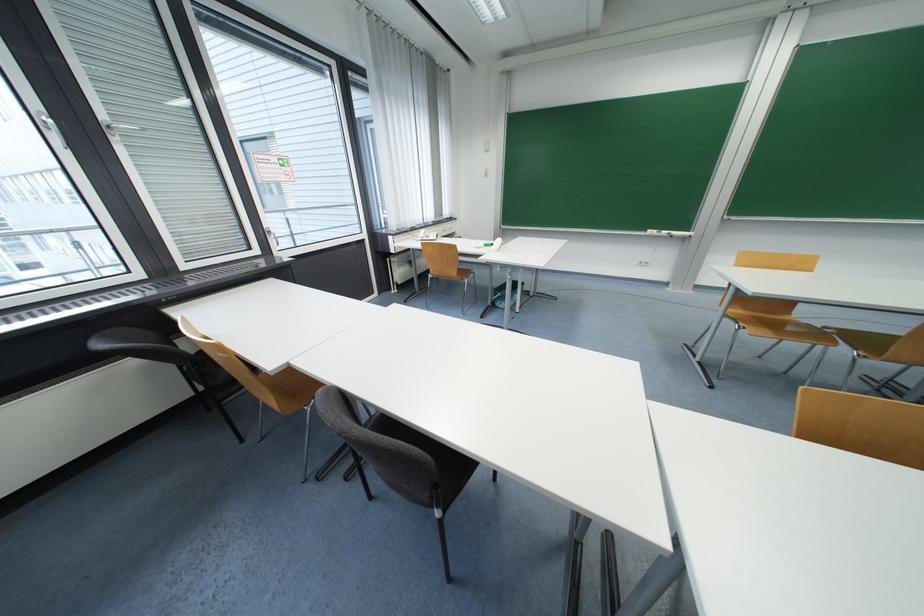
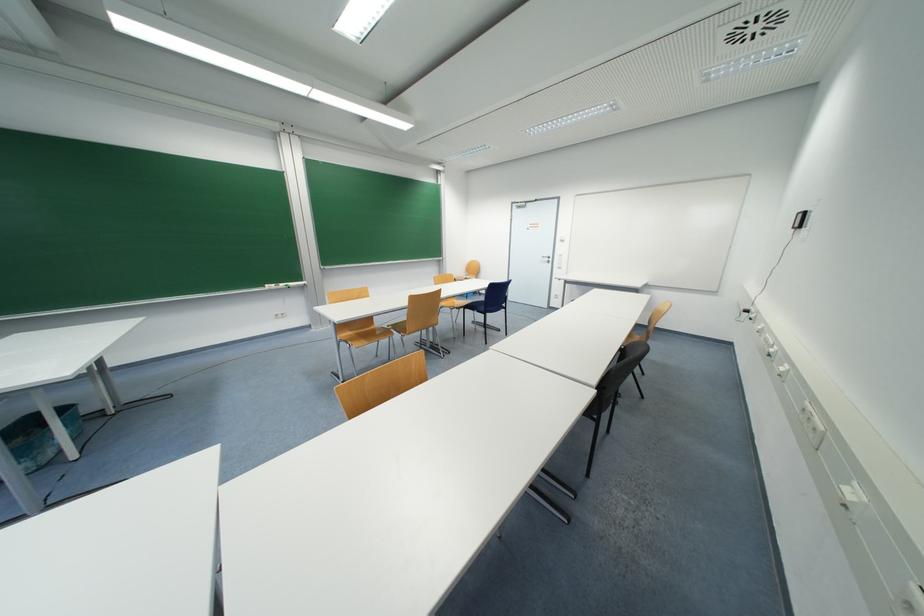
The point at (528, 285) is marked in the first image. Where is the corresponding point in the second image?

(69, 410)